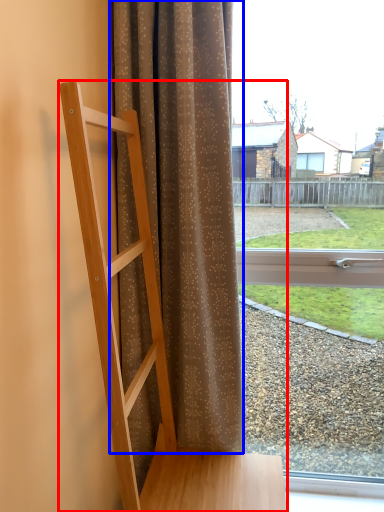
Question: Which point is further to the camera, furniture (highlighted by a red box) or curtain (highlighted by a blue box)?

Choices:
 (A) furniture
 (B) curtain

Answer: (B)